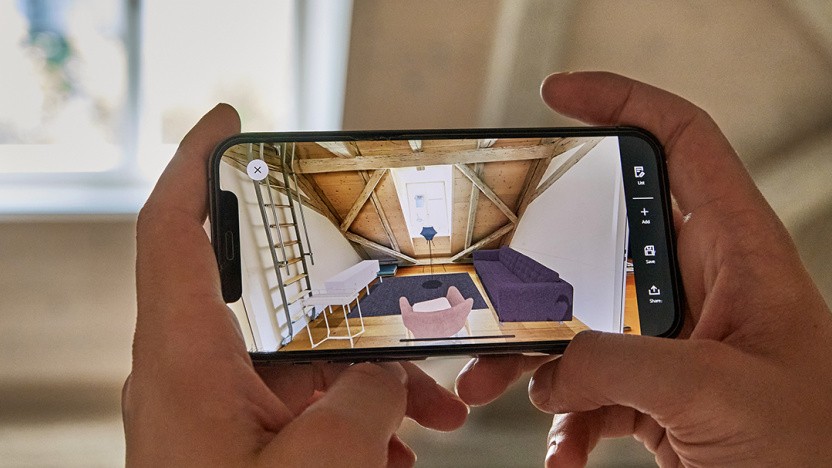
The image size is (832, 468). What are the coordinates of `beams` in the screenshot? It's located at (532, 42), (800, 173), (810, 16).